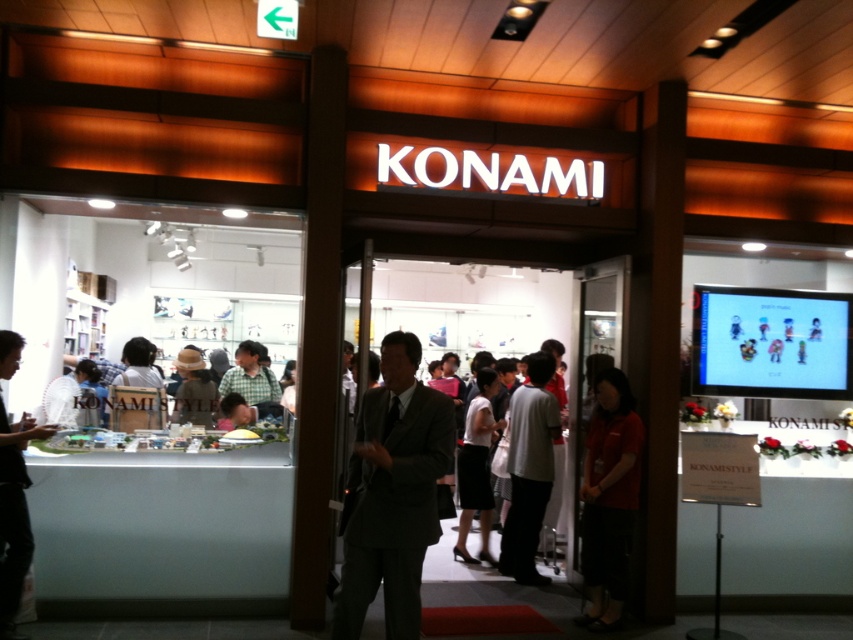
Question: Considering the relative positions of red smooth shirt at lower right and dark gray suit at left in the image provided, where is red smooth shirt at lower right located with respect to dark gray suit at left?

Choices:
 (A) right
 (B) left

Answer: (A)

Question: Which object is the farthest from the red smooth shirt at lower right?

Choices:
 (A) white fabric skirt at center
 (B) dark gray suit at left

Answer: (B)

Question: Which object is closer to the camera taking this photo?

Choices:
 (A) white fabric skirt at center
 (B) gray suit at center
 (C) gray fabric shirt at center

Answer: (B)

Question: Does red smooth shirt at lower right have a greater width compared to dark gray suit at left?

Choices:
 (A) no
 (B) yes

Answer: (B)

Question: Is gray suit at center above dark gray suit at left?

Choices:
 (A) no
 (B) yes

Answer: (B)

Question: Which point is farther to the camera?

Choices:
 (A) (485, 545)
 (B) (384, 500)
 (C) (541, 353)
 (D) (605, 456)

Answer: (A)